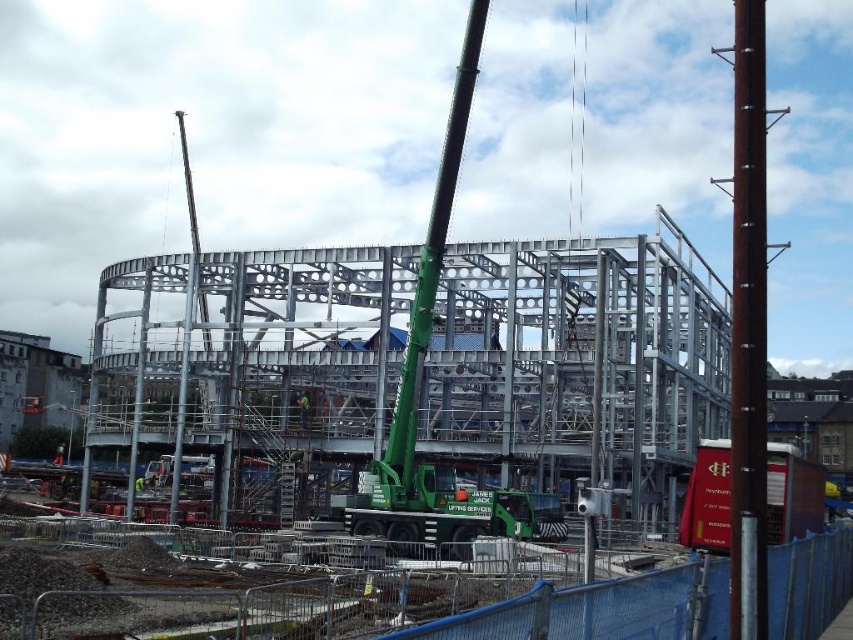
Measure the distance between brown wooden pole at right and camera.

brown wooden pole at right is 48.97 meters from camera.

Based on the photo, is brown wooden pole at right thinner than green metallic crane at center?

No.

Locate an element on the screen. The width and height of the screenshot is (853, 640). brown wooden pole at right is located at coordinates (747, 328).

Between brown wooden pole at right and green fabric construction worker at center, which one has less height?

green fabric construction worker at center

What do you see at coordinates (747, 328) in the screenshot?
I see `brown wooden pole at right` at bounding box center [747, 328].

Is point (759, 449) less distant than point (299, 422)?

Yes, it is.

The width and height of the screenshot is (853, 640). In order to click on brown wooden pole at right in this screenshot , I will do `click(747, 328)`.

Between green metallic crane at center and green fabric construction worker at center, which one is positioned higher?

green metallic crane at center is above.

Who is positioned more to the left, green metallic crane at center or green fabric construction worker at center?

green fabric construction worker at center

Which is behind, point (416, 296) or point (300, 426)?

The point (300, 426) is more distant.

The image size is (853, 640). In order to click on green metallic crane at center in this screenshot , I will do `click(418, 376)`.